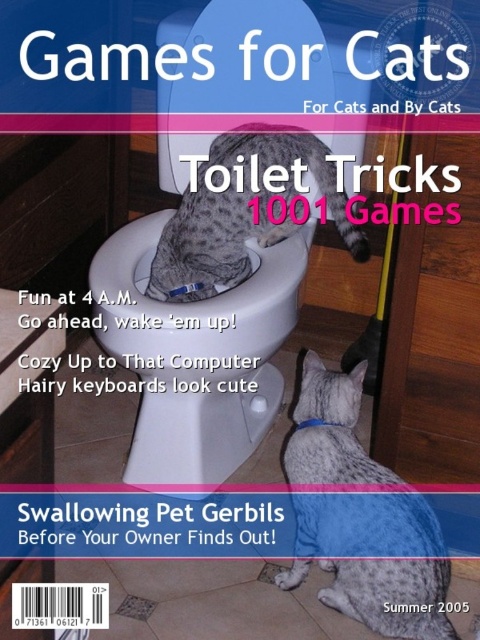
What is the position of the white glossy toilet bowl at center in the image?

The white glossy toilet bowl at center is located at point (x=202, y=346).

Looking at the magazine cover, there are two cats. One is inside the white glossy toilet bowl at center and the other is at the gray spotted fur at lower right. Which cat is positioned to the right side of the magazine cover?

The gray spotted fur at lower right is positioned to the right side of the magazine cover, so the cat with gray spotted fur at lower right is on the right side.

You are a cat owner who wants to ensure your cats are positioned safely. Given the spotted fur cat at center and the gray spotted fur at lower right, which cat is higher up in the image?

The spotted fur cat at center is higher up in the image than the gray spotted fur at lower right because it is positioned above it according to the description.